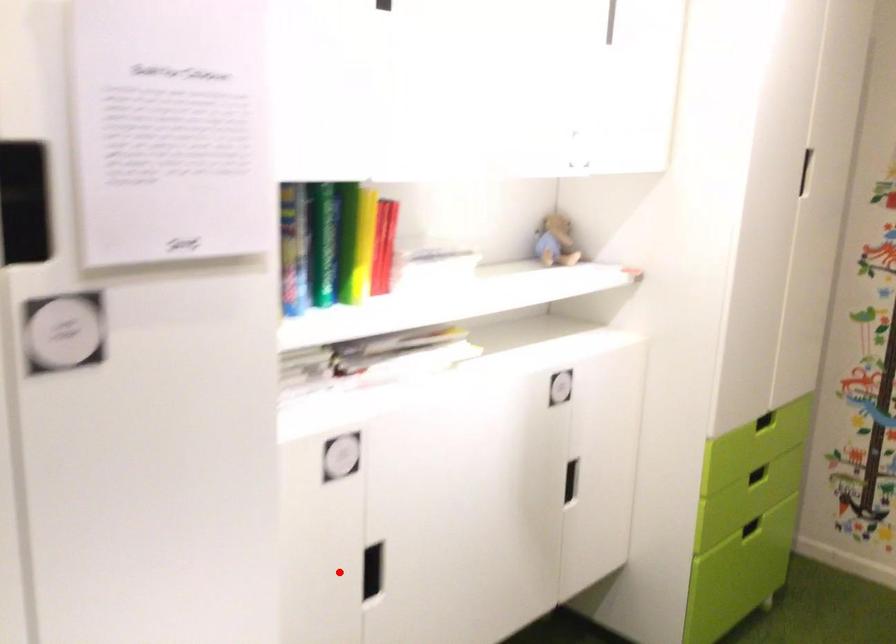
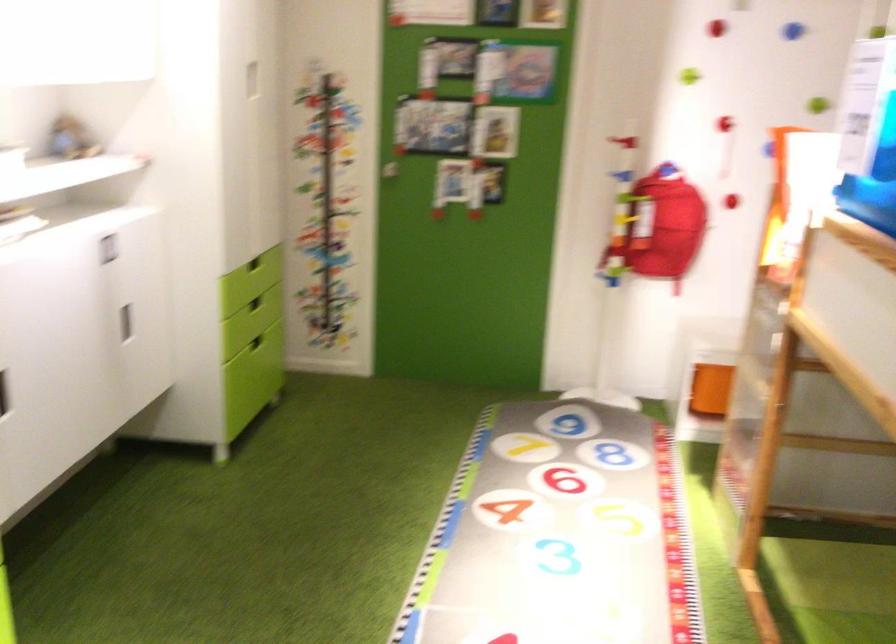
Find the pixel in the second image that matches the highlighted location in the first image.

(3, 393)